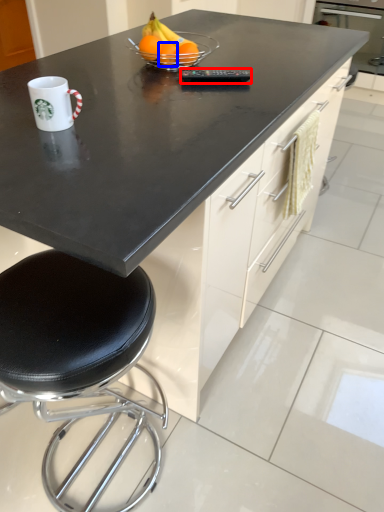
Question: Among these objects, which one is nearest to the camera, appliance (highlighted by a red box) or orange (highlighted by a blue box)?

Choices:
 (A) appliance
 (B) orange

Answer: (A)